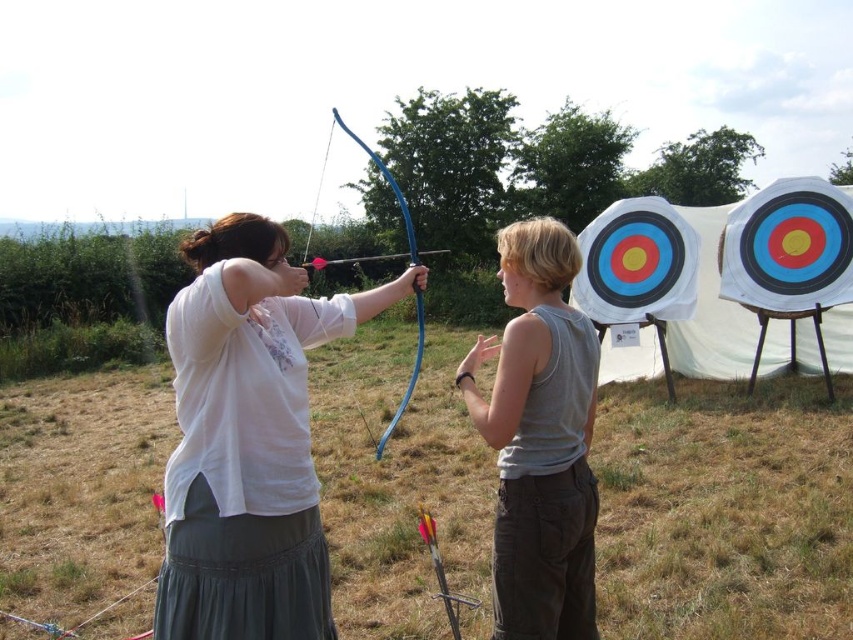
How distant is white matte shirt at center from gray cotton tank top at center?

white matte shirt at center and gray cotton tank top at center are 25.84 inches apart.

Does white matte shirt at center have a lesser height compared to gray cotton tank top at center?

Yes, white matte shirt at center is shorter than gray cotton tank top at center.

Which is behind, point (308, 330) or point (554, 566)?

The point (308, 330) is more distant.

The width and height of the screenshot is (853, 640). I want to click on white matte shirt at center, so click(248, 438).

Who is more distant from viewer, (376,257) or (468,604)?

The point (376,257) is more distant.

Is blue wood bow at center positioned behind yellow arrow at center?

No, it is in front of yellow arrow at center.

The width and height of the screenshot is (853, 640). In order to click on blue wood bow at center in this screenshot , I will do `click(387, 182)`.

Measure the distance from white matte shirt at center to blue wood bow at center.

13.86 feet

Identify the location of white matte shirt at center. The height and width of the screenshot is (640, 853). (248, 438).

Measure the distance between white matte shirt at center and camera.

They are 5.40 feet apart.

Image resolution: width=853 pixels, height=640 pixels. Identify the location of white matte shirt at center. (248, 438).